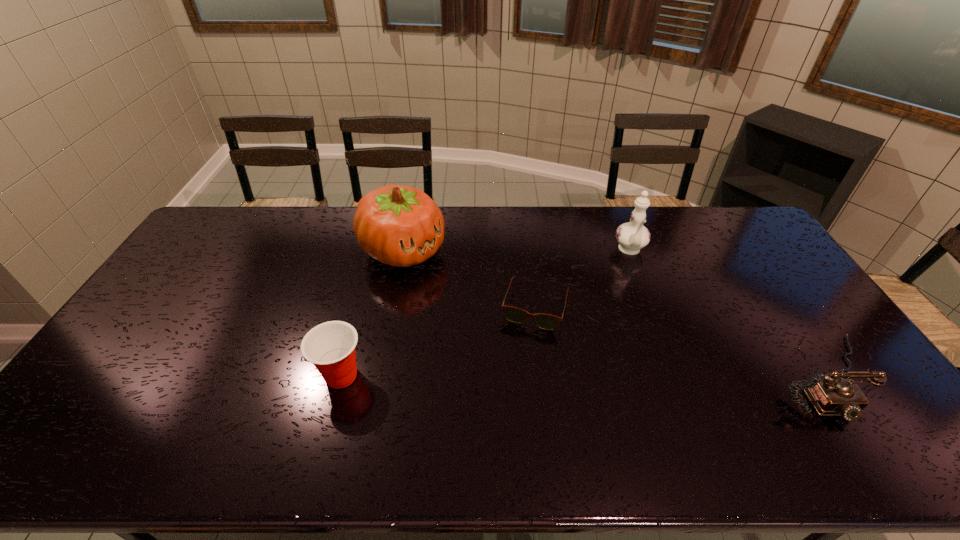
What are the coordinates of `free spot located at the spout of the second object from right to left` in the screenshot? It's located at (641, 310).

Locate an element on the screen. Image resolution: width=960 pixels, height=540 pixels. vacant region located at the spout of the second object from right to left is located at coordinates (637, 287).

Find the location of a particular element. The height and width of the screenshot is (540, 960). free space located 0.220m at the spout of the second object from right to left is located at coordinates (642, 312).

At what (x,y) coordinates should I click in order to perform the action: click on vacant space located 0.260m on the side of the pumpkin with the cute face. Please return your answer as a coordinate pair (x, y). Looking at the image, I should click on (488, 311).

Where is `free space located on the side of the pumpkin with the cute face`? This screenshot has width=960, height=540. free space located on the side of the pumpkin with the cute face is located at coordinates point(488,311).

Locate an element on the screen. vacant space situated 0.220m on the side of the pumpkin with the cute face is located at coordinates (478, 305).

The image size is (960, 540). I want to click on chinaware present at the far edge, so click(x=632, y=236).

Identify the location of pumpkin that is at the far edge. This screenshot has height=540, width=960. (400, 226).

At what (x,y) coordinates should I click in order to perform the action: click on cup that is at the near edge. Please return your answer as a coordinate pair (x, y). The image size is (960, 540). Looking at the image, I should click on (330, 346).

You are a GUI agent. You are given a task and a screenshot of the screen. Output one action in this format:
    pyautogui.click(x=<x>, y=<y>)
    Task: Click on the telephone at the near edge
    The image size is (960, 540).
    Given the screenshot: What is the action you would take?
    pyautogui.click(x=830, y=396)